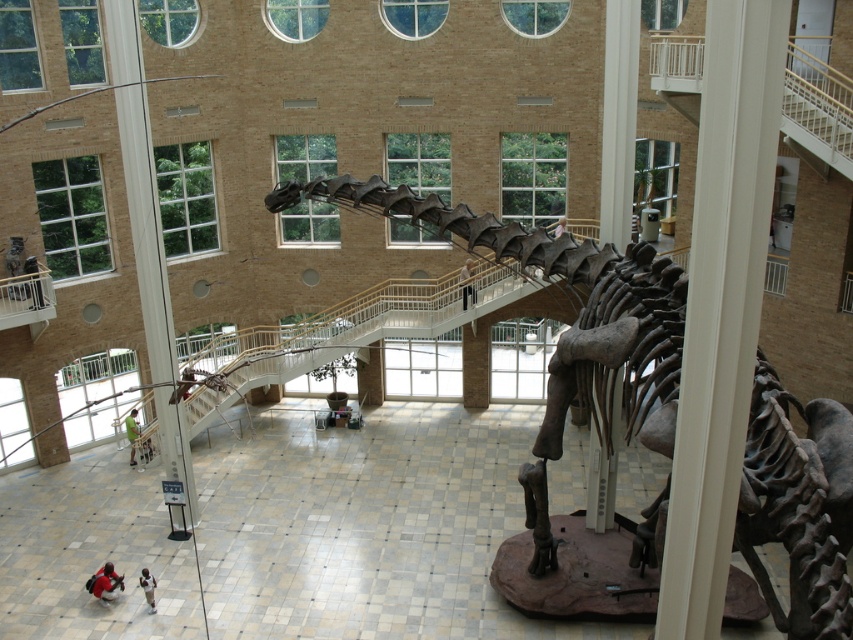
You are standing in the building and want to take a photo of both the black fabric pants at center and the green fabric person at lower left. Which one should you focus on first to ensure both are in clear view?

You should focus on the black fabric pants at center first since it is closer to you than the green fabric person at lower left, ensuring both are in clear view.

You are standing at the entrance of the building and want to walk towards the dinosaur skeleton in the center. There are two points marked on the floor at coordinates point (x=753, y=506) and point (x=131, y=456). Which point should you step on first as you move toward the dinosaur skeleton?

You should step on point (x=753, y=506) first because it is in front of point (x=131, y=456) when moving toward the dinosaur skeleton.